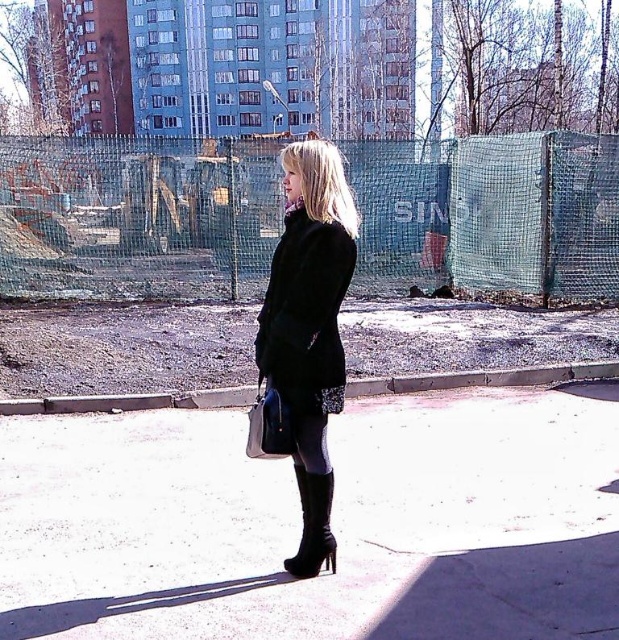
Question: Which point is farther to the camera?

Choices:
 (A) black leather coat at center
 (B) black wool coat at center

Answer: (A)

Question: Does black leather boots at center appear over black leather coat at center?

Choices:
 (A) no
 (B) yes

Answer: (A)

Question: Which point is closer to the camera taking this photo?

Choices:
 (A) (310, 396)
 (B) (233, 416)
 (C) (314, 493)

Answer: (A)

Question: Which object is closer to the camera taking this photo?

Choices:
 (A) black leather coat at center
 (B) black wool coat at center
 (C) black leather boots at center
 (D) black leather boot at lower center

Answer: (C)

Question: Does black leather boots at center appear on the left side of black leather boot at lower center?

Choices:
 (A) yes
 (B) no

Answer: (B)

Question: Is black leather coat at center to the right of black wool coat at center from the viewer's perspective?

Choices:
 (A) no
 (B) yes

Answer: (A)